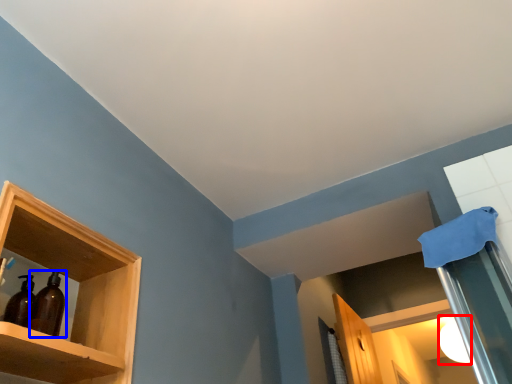
Question: Which of the following is the farthest to the observer, lighting (highlighted by a red box) or bottle (highlighted by a blue box)?

Choices:
 (A) lighting
 (B) bottle

Answer: (A)